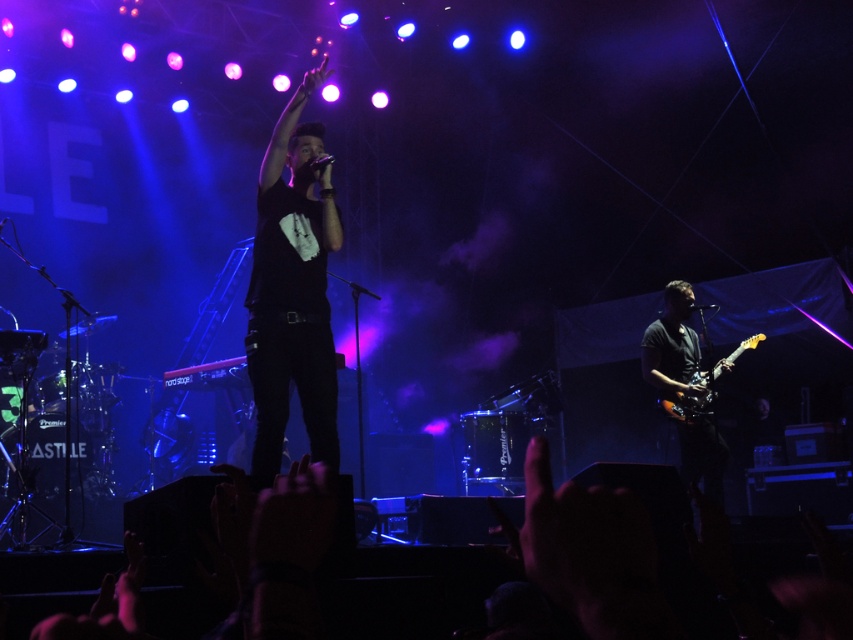
Can you confirm if shiny black guitar at right is smaller than glossy wood electric guitar at right?

No.

Is point (677, 378) positioned behind point (693, 403)?

Yes, it is behind point (693, 403).

This screenshot has height=640, width=853. In order to click on shiny black guitar at right in this screenshot , I will do `click(672, 346)`.

Which is in front, point (308, 392) or point (697, 413)?

Point (308, 392)

Which is above, black matte shirt at center or glossy wood electric guitar at right?

Positioned higher is black matte shirt at center.

Does point (281, 192) lie in front of point (698, 396)?

Yes, it is in front of point (698, 396).

Locate an element on the screen. This screenshot has height=640, width=853. black matte shirt at center is located at coordinates (292, 291).

Which is more to the right, black matte shirt at center or shiny black guitar at right?

shiny black guitar at right

The image size is (853, 640). What do you see at coordinates (292, 291) in the screenshot? I see `black matte shirt at center` at bounding box center [292, 291].

In order to click on black matte shirt at center in this screenshot , I will do `click(292, 291)`.